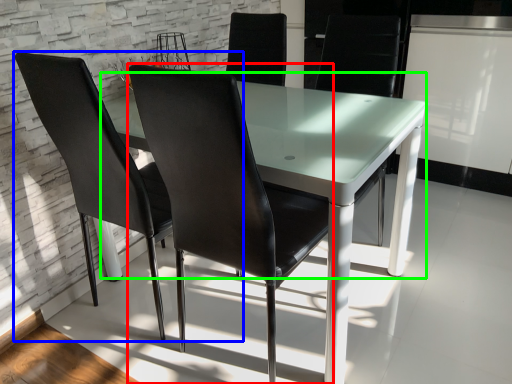
Question: Based on their relative distances, which object is farther from chair (highlighted by a red box)? Choose from chair (highlighted by a blue box) and round table (highlighted by a green box).

Choices:
 (A) chair
 (B) round table

Answer: (A)